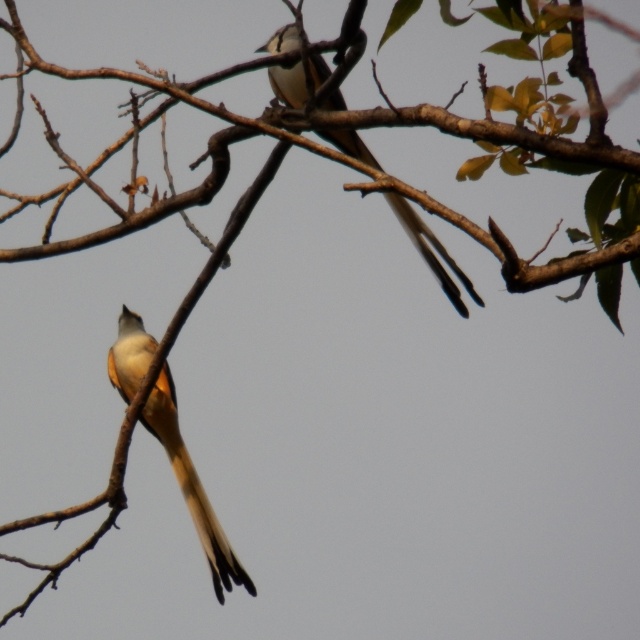
You are a photographer trying to capture the light brown feathered tail at lower left in the center of your camera frame. Given its current position at point 0.761 on the horizontal axis and 0.300 on the vertical axis, would you need to adjust your camera to the left or right to center it horizontally?

The light brown feathered tail at lower left is located at point 0.761 on the horizontal axis. Since the center of the frame is at 0.5, you need to move the camera to the right to center it horizontally.